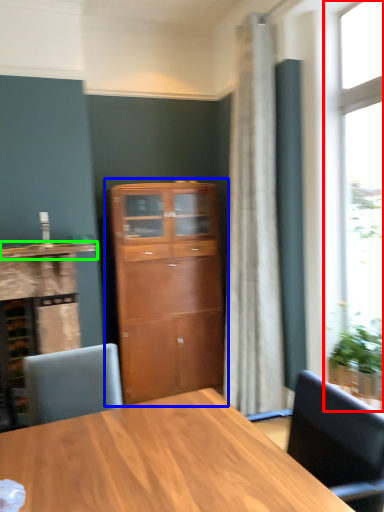
Question: Which object is positioned farthest from window (highlighted by a red box)? Select from cupboard (highlighted by a blue box) and counter top (highlighted by a green box).

Choices:
 (A) cupboard
 (B) counter top

Answer: (B)